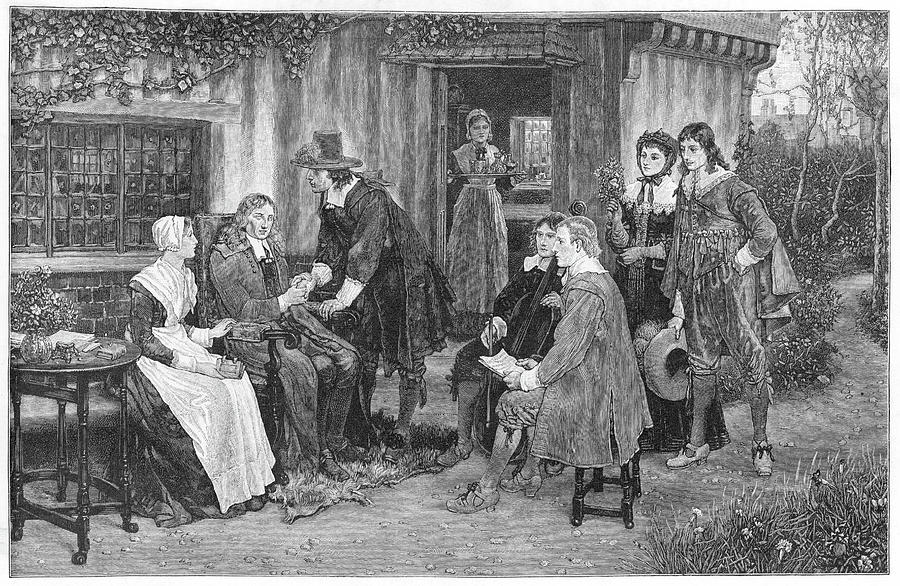
Where is `men sitting in chairs`? men sitting in chairs is located at coordinates (297, 355), (598, 346), (522, 301).